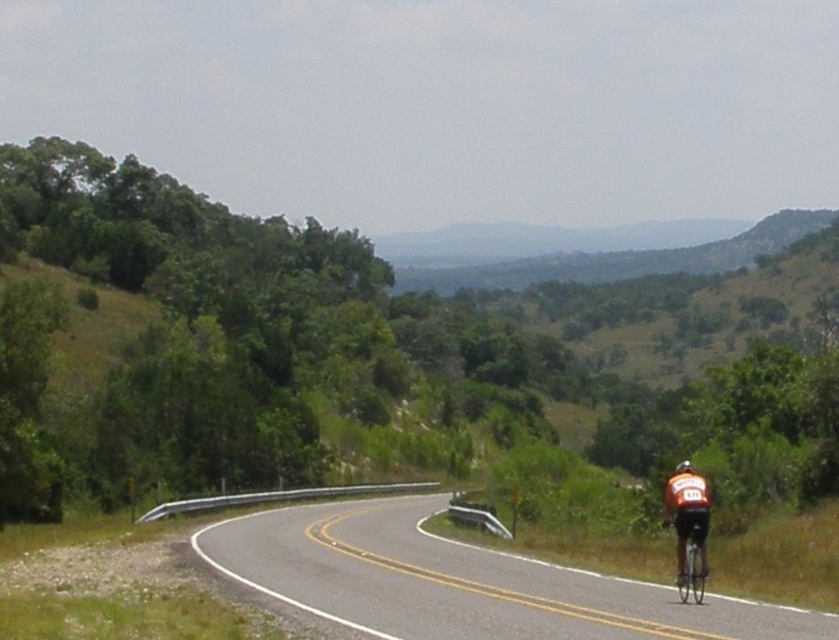
You are a drone operator trying to capture the cyclist in the image. The image has a coordinate system where the bottom left corner is the origin point. The cyclist is at a specific coordinate. Where should you position the drone to capture the orange fabric cyclist at lower right?

The orange fabric cyclist at lower right is located at coordinate point (686, 522). To capture the cyclist, position the drone at that coordinate.

You are a pedestrian standing at the center of the road in this scene. You see the orange fabric cyclist at lower right and the shiny silver bicycle at right. Which object is higher up in the image?

The orange fabric cyclist at lower right is above the shiny silver bicycle at right, so the cyclist is higher up in the image.